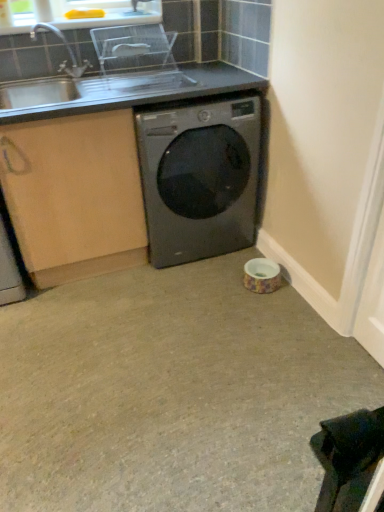
Question: Can you confirm if beige carpet at center is smaller than clear plastic dish rack at upper center?

Choices:
 (A) yes
 (B) no

Answer: (B)

Question: From a real-world perspective, is beige carpet at center over clear plastic dish rack at upper center?

Choices:
 (A) yes
 (B) no

Answer: (B)

Question: Is beige carpet at center looking in the opposite direction of clear plastic dish rack at upper center?

Choices:
 (A) yes
 (B) no

Answer: (B)

Question: Is beige carpet at center far from clear plastic dish rack at upper center?

Choices:
 (A) no
 (B) yes

Answer: (B)

Question: Can you confirm if beige carpet at center is thinner than clear plastic dish rack at upper center?

Choices:
 (A) yes
 (B) no

Answer: (B)

Question: Would you say beige carpet at center is inside or outside satin black washing machine at center?

Choices:
 (A) outside
 (B) inside

Answer: (A)

Question: From the image's perspective, is beige carpet at center positioned above or below satin black washing machine at center?

Choices:
 (A) above
 (B) below

Answer: (B)

Question: Considering the relative positions of beige carpet at center and satin black washing machine at center in the image provided, is beige carpet at center to the left or to the right of satin black washing machine at center?

Choices:
 (A) right
 (B) left

Answer: (B)

Question: Looking at their shapes, would you say beige carpet at center is wider or thinner than satin black washing machine at center?

Choices:
 (A) thin
 (B) wide

Answer: (B)

Question: From the image's perspective, is silver metallic sink at upper left positioned above or below beige carpet at center?

Choices:
 (A) below
 (B) above

Answer: (B)

Question: Is silver metallic sink at upper left inside or outside of beige carpet at center?

Choices:
 (A) inside
 (B) outside

Answer: (B)

Question: Based on their sizes in the image, would you say silver metallic sink at upper left is bigger or smaller than beige carpet at center?

Choices:
 (A) big
 (B) small

Answer: (A)

Question: Does point (100, 57) appear closer or farther from the camera than point (291, 298)?

Choices:
 (A) closer
 (B) farther

Answer: (B)

Question: From the image's perspective, is silver metallic sink at upper left above or below clear plastic dish rack at upper center?

Choices:
 (A) below
 (B) above

Answer: (A)

Question: From a real-world perspective, is silver metallic sink at upper left physically located above or below clear plastic dish rack at upper center?

Choices:
 (A) below
 (B) above

Answer: (A)